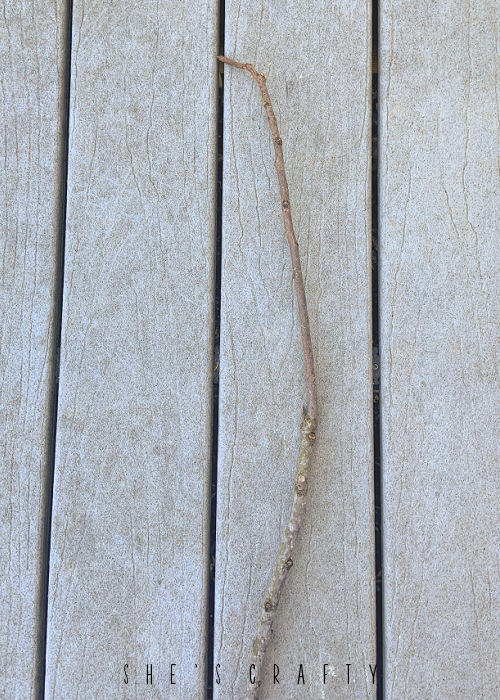
Where is `very left plank of wood`? The width and height of the screenshot is (500, 700). very left plank of wood is located at coordinates (38, 395).